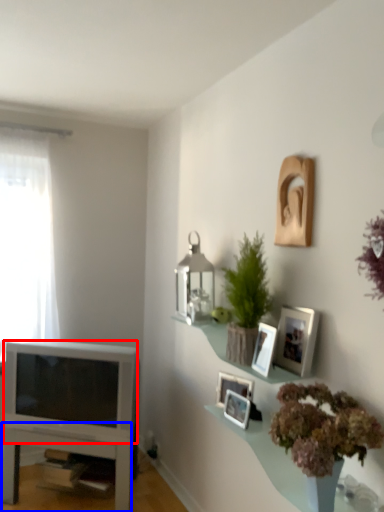
Question: Among these objects, which one is farthest to the camera, television (highlighted by a red box) or table (highlighted by a blue box)?

Choices:
 (A) television
 (B) table

Answer: (B)